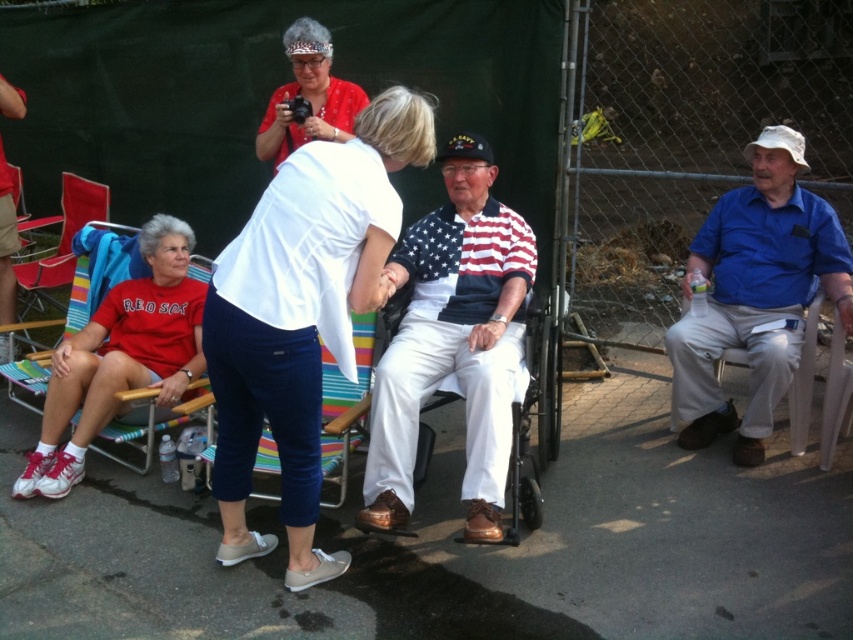
Is point (701, 436) farther from viewer compared to point (183, 317)?

Yes, it is behind point (183, 317).

Is blue cotton shirt at right closer to camera compared to white matte/red sox t-shirt at lower left?

No, it is behind white matte/red sox t-shirt at lower left.

Who is more distant from viewer, (711, 272) or (158, 355)?

The point (711, 272) is behind.

I want to click on blue cotton shirt at right, so click(755, 294).

Between white cotton shirt at center and matte red shirt at upper center, which one is positioned lower?

white cotton shirt at center

Between white cotton shirt at center and matte red shirt at upper center, which one appears on the right side from the viewer's perspective?

From the viewer's perspective, white cotton shirt at center appears more on the right side.

Does point (311, 150) lie behind point (305, 122)?

No, (311, 150) is closer to viewer.

I want to click on white cotton shirt at center, so click(x=302, y=316).

Can you confirm if blue cotton shirt at right is taller than matte red shirt at upper center?

Correct, blue cotton shirt at right is much taller as matte red shirt at upper center.

Can you confirm if blue cotton shirt at right is thinner than matte red shirt at upper center?

In fact, blue cotton shirt at right might be wider than matte red shirt at upper center.

Between point (751, 348) and point (274, 116), which one is positioned in front?

Positioned in front is point (751, 348).

Where is `blue cotton shirt at right`? blue cotton shirt at right is located at coordinates (755, 294).